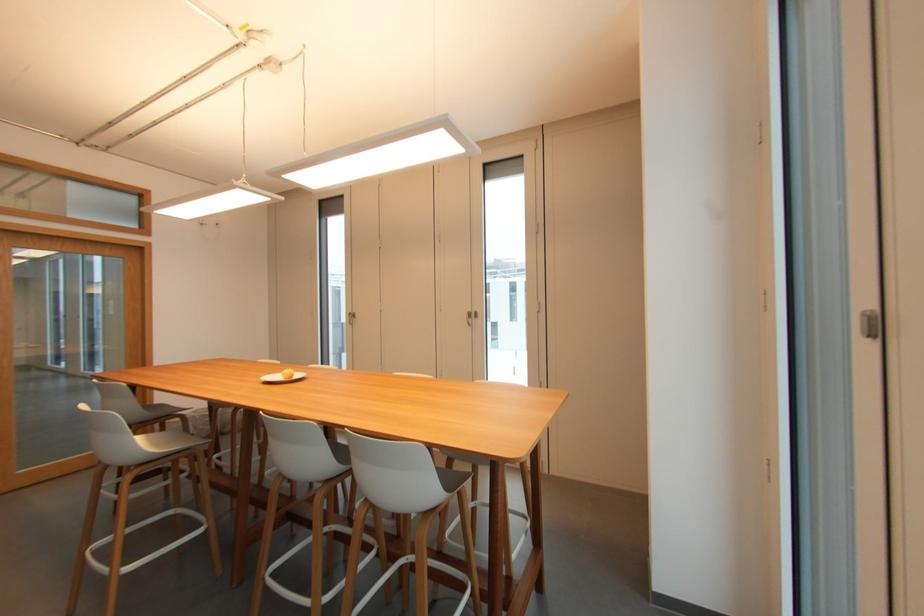
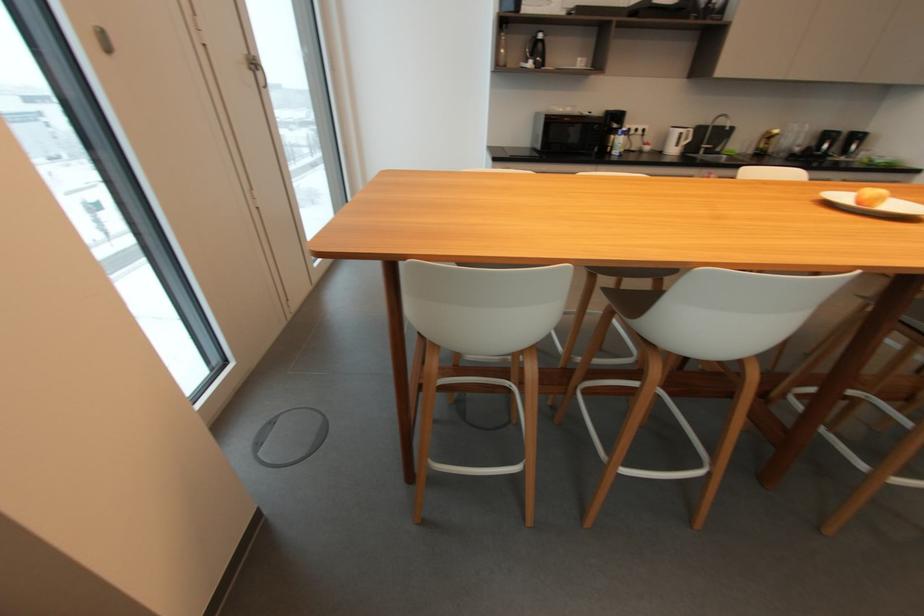
Locate, in the second image, the point that corresponds to point 292,371 in the first image.

(881, 191)